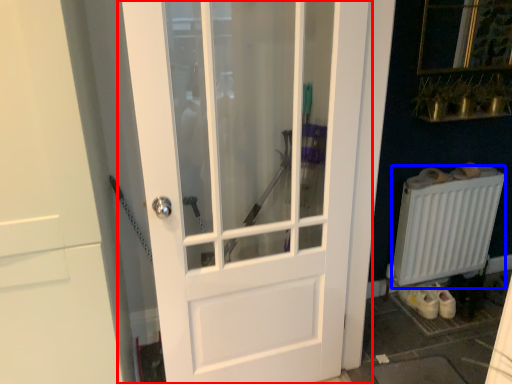
Question: Which object appears farthest to the camera in this image, door (highlighted by a red box) or radiator (highlighted by a blue box)?

Choices:
 (A) door
 (B) radiator

Answer: (B)